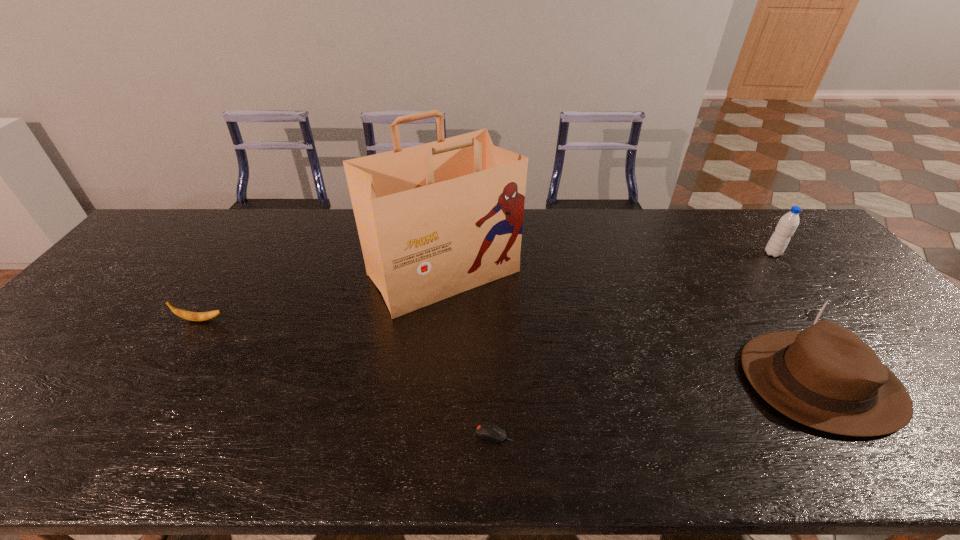
Locate an element on the screen. The width and height of the screenshot is (960, 540). free space located on the feather side of the fedora is located at coordinates (626, 381).

Locate an element on the screen. free space located on the peel of the leftmost object from the top is located at coordinates (334, 320).

Locate an element on the screen. The image size is (960, 540). vacant space located 0.060m on the left of the computer mouse is located at coordinates (447, 434).

The image size is (960, 540). What are the coordinates of `grocery bag that is positioned at the far edge` in the screenshot? It's located at pos(434,220).

Image resolution: width=960 pixels, height=540 pixels. I want to click on water bottle that is positioned at the far edge, so click(x=788, y=223).

This screenshot has height=540, width=960. Identify the location of fedora present at the near edge. (825, 377).

Locate an element on the screen. computer mouse that is positioned at the near edge is located at coordinates (486, 430).

Identify the location of water bottle situated at the right edge. This screenshot has width=960, height=540. (788, 223).

Find the location of a particular element. This screenshot has width=960, height=540. fedora that is at the right edge is located at coordinates (825, 377).

At what (x,y) coordinates should I click in order to perform the action: click on object situated at the far right corner. Please return your answer as a coordinate pair (x, y). Looking at the image, I should click on (788, 223).